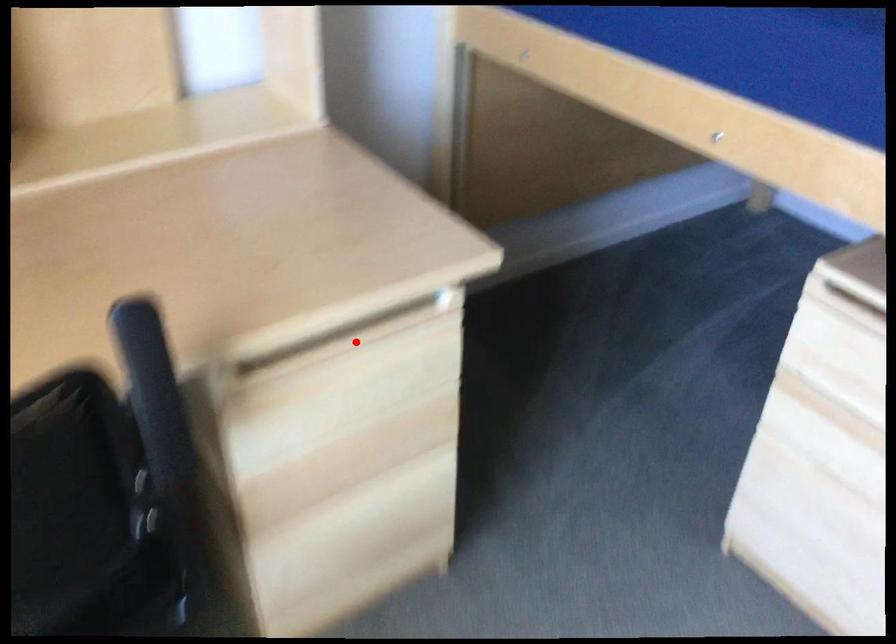
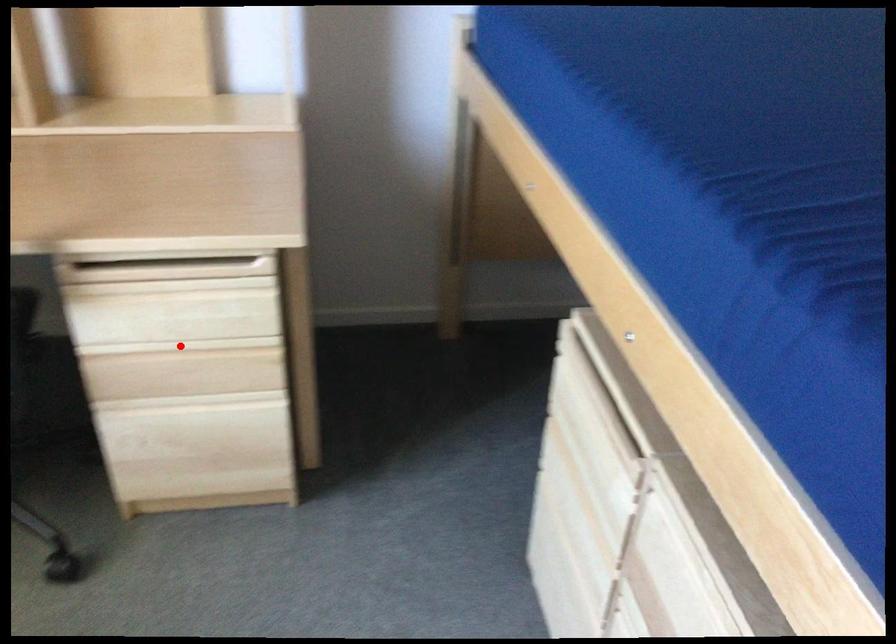
I am providing you with two images of the same scene from different viewpoints. A red point is marked on the first image and another point is marked on the second image. Do the highlighted points in image1 and image2 indicate the same real-world spot?

No